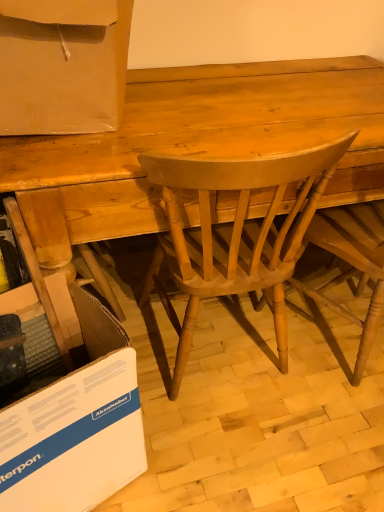
Question: From the image's perspective, is white cardboard at lower left below matte cardboard box at upper left?

Choices:
 (A) yes
 (B) no

Answer: (A)

Question: Would you say white cardboard at lower left is outside matte cardboard box at upper left?

Choices:
 (A) yes
 (B) no

Answer: (A)

Question: From a real-world perspective, is white cardboard at lower left beneath matte cardboard box at upper left?

Choices:
 (A) no
 (B) yes

Answer: (B)

Question: From the image's perspective, is white cardboard at lower left above matte cardboard box at upper left?

Choices:
 (A) yes
 (B) no

Answer: (B)

Question: Does white cardboard at lower left have a lesser height compared to matte cardboard box at upper left?

Choices:
 (A) no
 (B) yes

Answer: (A)

Question: Is white cardboard at lower left bigger or smaller than light brown wood chair at center, which is the 1th chair from left to right?

Choices:
 (A) small
 (B) big

Answer: (A)

Question: Is white cardboard at lower left wider or thinner than light brown wood chair at center, which is the 1th chair from left to right?

Choices:
 (A) wide
 (B) thin

Answer: (B)

Question: Based on their positions, is white cardboard at lower left located to the left or right of light brown wood chair at center, which is the 1th chair from left to right?

Choices:
 (A) left
 (B) right

Answer: (A)

Question: From the image's perspective, is white cardboard at lower left located above or below light brown wood chair at center, which is the 1th chair from left to right?

Choices:
 (A) below
 (B) above

Answer: (A)

Question: Considering their positions, is light brown wood chair at center, which is the 1th chair from left to right, located in front of or behind light brown wood chair at center, arranged as the first chair when viewed from the right?

Choices:
 (A) front
 (B) behind

Answer: (A)

Question: Looking at their shapes, would you say light brown wood chair at center, arranged as the 2th chair when viewed from the right, is wider or thinner than light brown wood chair at center, the second chair viewed from the left?

Choices:
 (A) thin
 (B) wide

Answer: (B)

Question: From a real-world perspective, relative to light brown wood chair at center, arranged as the first chair when viewed from the right, is light brown wood chair at center, which is the 1th chair from left to right, vertically above or below?

Choices:
 (A) above
 (B) below

Answer: (A)

Question: Do you think light brown wood chair at center, which is the 1th chair from left to right, is within light brown wood chair at center, arranged as the first chair when viewed from the right, or outside of it?

Choices:
 (A) outside
 (B) inside

Answer: (A)

Question: From the image's perspective, is light brown wood chair at center, arranged as the 2th chair when viewed from the right, above or below light brown wood desk at center?

Choices:
 (A) below
 (B) above

Answer: (A)

Question: Based on their sizes in the image, would you say light brown wood chair at center, which is the 1th chair from left to right, is bigger or smaller than light brown wood desk at center?

Choices:
 (A) big
 (B) small

Answer: (B)